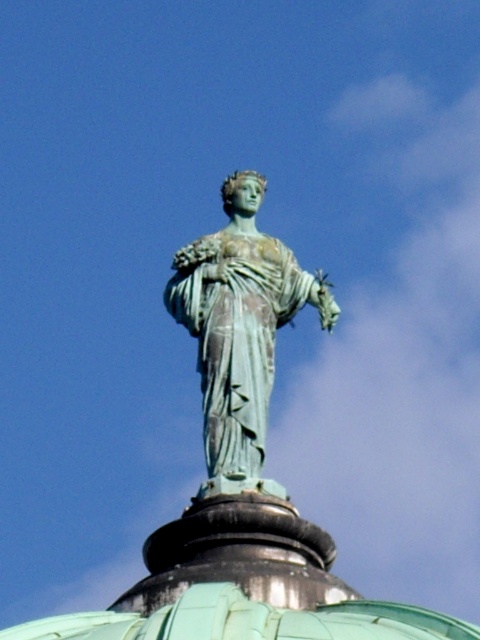
Which is behind, point (223, 280) or point (348, 630)?

Positioned behind is point (223, 280).

This screenshot has height=640, width=480. I want to click on green patina statue at center, so click(x=239, y=330).

The height and width of the screenshot is (640, 480). What are the coordinates of `green patina statue at center` in the screenshot? It's located at (239, 330).

Find the location of a particular element. green patina statue at center is located at coordinates (239, 330).